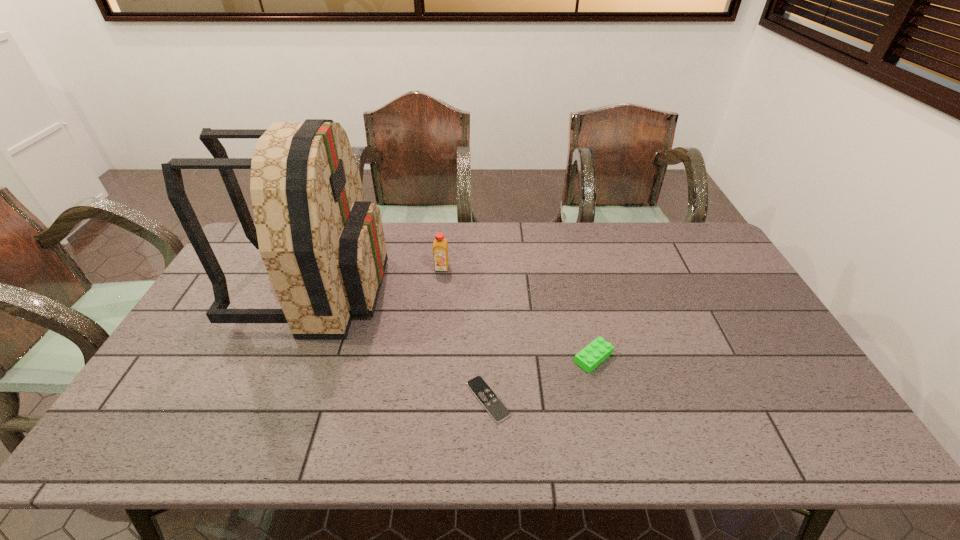
Where is `free point between the Lego and the backpack`? The height and width of the screenshot is (540, 960). free point between the Lego and the backpack is located at coordinates (455, 323).

The width and height of the screenshot is (960, 540). What are the coordinates of `the closest object to the shortest object` in the screenshot? It's located at (596, 352).

Locate an element on the screen. This screenshot has height=540, width=960. the second closest object to the rightmost object is located at coordinates (440, 250).

Image resolution: width=960 pixels, height=540 pixels. I want to click on vacant position in the image that satisfies the following two spatial constraints: 1. on the front and back of the orange juice; 2. on the right side of the nearest object, so click(428, 399).

Locate an element on the screen. free space that satisfies the following two spatial constraints: 1. on the front and back of the orange juice; 2. on the left side of the Lego is located at coordinates (433, 357).

At what (x,y) coordinates should I click in order to perform the action: click on free space that satisfies the following two spatial constraints: 1. on the front face of the tallest object; 2. on the right side of the third tallest object. Please return your answer as a coordinate pair (x, y). This screenshot has height=540, width=960. Looking at the image, I should click on (287, 357).

Where is `vacant space that satisfies the following two spatial constraints: 1. on the front and back of the orange juice; 2. on the front face of the leftmost object`? vacant space that satisfies the following two spatial constraints: 1. on the front and back of the orange juice; 2. on the front face of the leftmost object is located at coordinates (440, 288).

I want to click on free location that satisfies the following two spatial constraints: 1. on the front and back of the Lego; 2. on the left side of the second object from left to right, so click(433, 357).

Locate an element on the screen. This screenshot has width=960, height=540. vacant space that satisfies the following two spatial constraints: 1. on the front and back of the shortest object; 2. on the left side of the second object from left to right is located at coordinates (428, 399).

You are a GUI agent. You are given a task and a screenshot of the screen. Output one action in this format:
    pyautogui.click(x=<x>, y=<y>)
    Task: Click on the free spot that satisfies the following two spatial constraints: 1. on the front and back of the second tallest object; 2. on the left side of the rightmost object
    This screenshot has height=540, width=960.
    Given the screenshot: What is the action you would take?
    pyautogui.click(x=433, y=357)